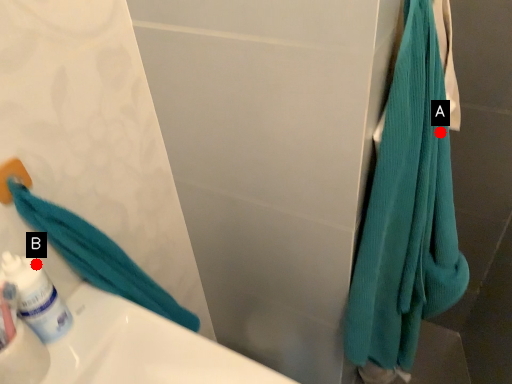
Question: Two points are circled on the image, labeled by A and B beside each circle. Which point appears farthest from the camera in this image?

Choices:
 (A) A is further
 (B) B is further

Answer: (A)